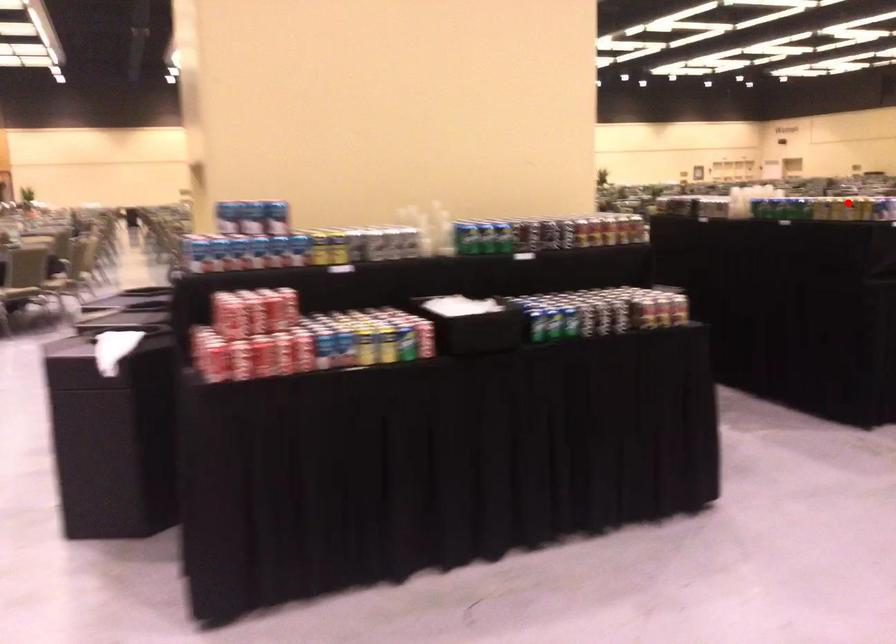
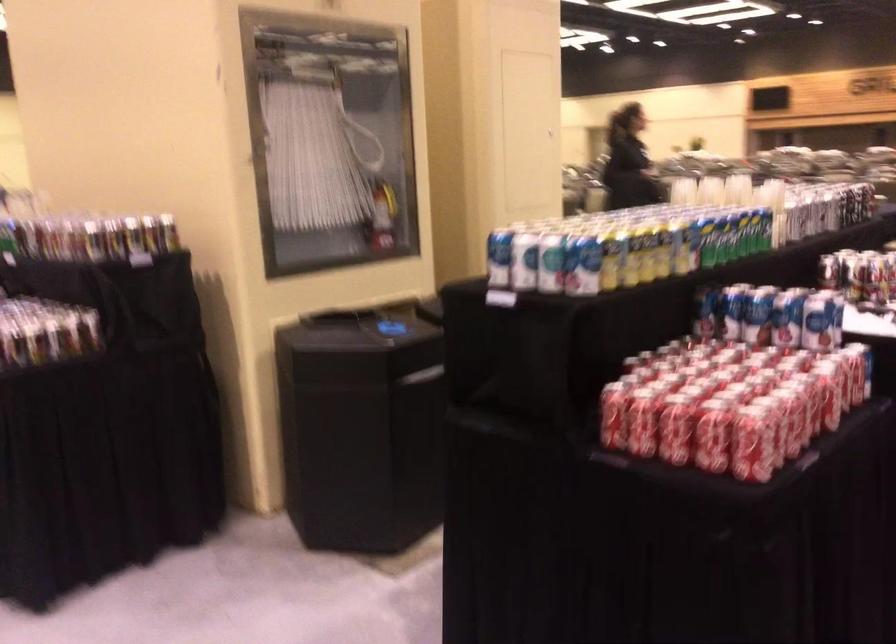
Question: I am providing you with two images of the same scene from different viewpoints. A red point is marked on the first image. Can you still see the location of the red point in image 2?

Choices:
 (A) Yes
 (B) No

Answer: (B)